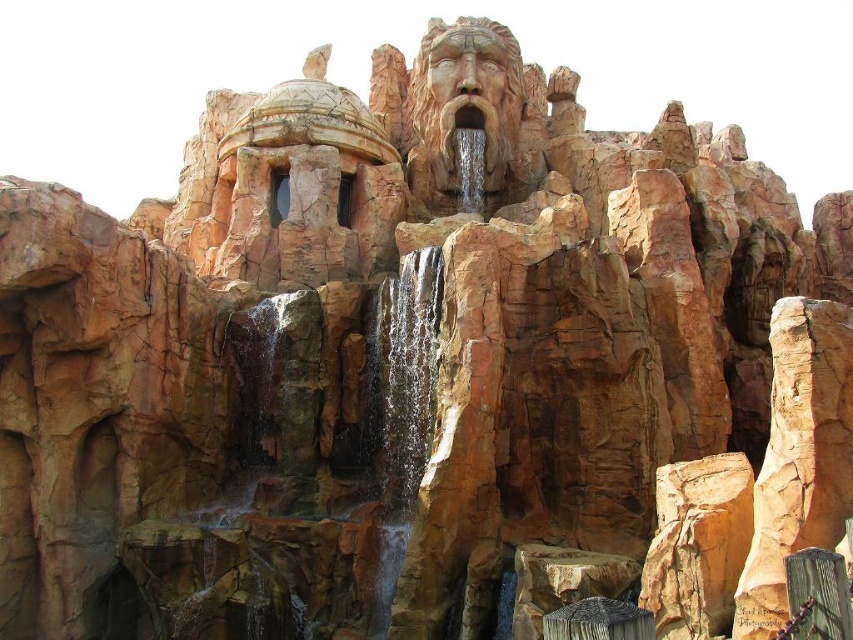
You are a visitor at the rock formation and want to take a photo of both the clear water at center and the brown textured waterfall at center. Which one should you focus on to ensure they both fit in the frame?

The clear water at center has a larger width than the brown textured waterfall at center, so focusing on the clear water at center will ensure both fit in the frame.

You are standing at the entrance of the rock formation and want to take a photo of both the clear water at center and the brown textured waterfall at center. How far apart are these two features from your current position?

The clear water at center is 35.96 meters away from the brown textured waterfall at center, so the distance between them from your current position is 35.96 meters.

In the scene shown: You are a visitor at the theme park and want to take a photo of the clear water at center without the brown textured waterfall at center blocking the view. Is it possible to position yourself in a way that the waterfall is not in the frame?

The clear water at center is located below the brown textured waterfall at center, so if you position yourself lower or angle your camera downward, you can capture the clear water at center without the waterfall obstructing the view.